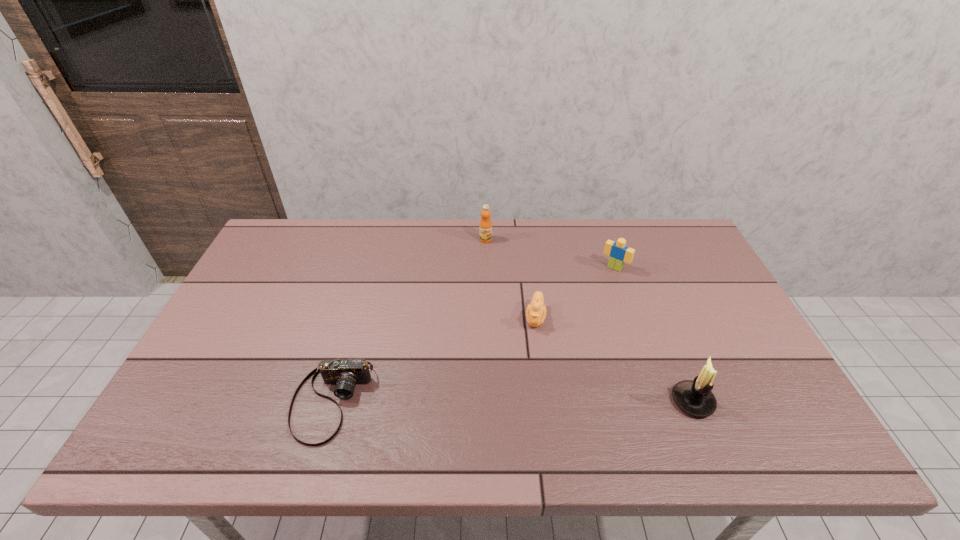
Locate an element on the screen. the leftmost object is located at coordinates (345, 374).

Locate an element on the screen. The height and width of the screenshot is (540, 960). the shortest object is located at coordinates (345, 374).

I want to click on candle holder, so click(694, 397).

You are a GUI agent. You are given a task and a screenshot of the screen. Output one action in this format:
    pyautogui.click(x=<x>, y=<y>)
    Task: Click on the farthest object
    
    Given the screenshot: What is the action you would take?
    pyautogui.click(x=485, y=227)

This screenshot has height=540, width=960. In order to click on the fourth object from right to left in this screenshot , I will do `click(485, 227)`.

At what (x,y) coordinates should I click in order to perform the action: click on duckling. Please return your answer as a coordinate pair (x, y). This screenshot has height=540, width=960. Looking at the image, I should click on (536, 311).

The image size is (960, 540). Identify the location of the third nearest object. (536, 311).

Find the location of a particular element. This screenshot has width=960, height=540. the third tallest object is located at coordinates (619, 253).

Locate an element on the screen. Lego is located at coordinates (619, 253).

What are the coordinates of `free spot located 0.160m on the right of the candle holder` in the screenshot? It's located at (781, 401).